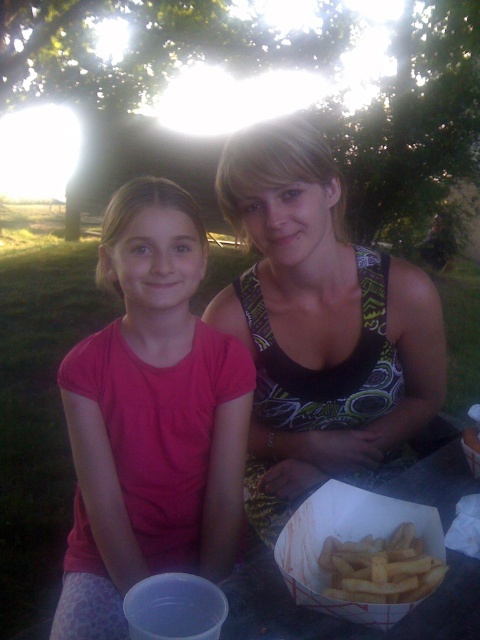
You are a photographer standing in front of the matte pink shirt at center. You want to take a closeup photo of it without getting too close. What is the minimum distance you need to move forward to get into position?

The matte pink shirt at center and viewer are 91.60 centimeters apart from each other, so you need to move forward at least 91.60 centimeters to get into position for the closeup photo.

Looking at this image, you are a photographer trying to capture a closeup of the golden crispy fries at lower center without including the matte pink shirt at center in the frame. Based on their positions, is this possible?

The matte pink shirt at center is to the left of golden crispy fries at lower center, so if you position your camera to the right side of the fries, you can frame the shot to exclude the shirt.

You are a photographer who wants to capture a closeup of the golden crispy fries at lower center without including the black printed tank top at center in the frame. Based on their positions, which direction should you move your camera to the right or left?

The black printed tank top at center is positioned on the left side of golden crispy fries at lower center. To avoid including the black printed tank top at center in the frame, move the camera to the right.